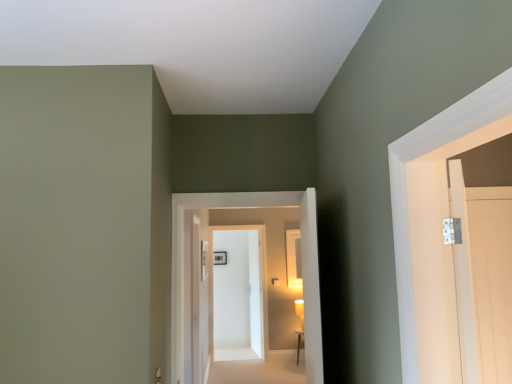
Question: Do you think white glossy door at center, the 3th door viewed from the right, is within white glossy door at center, the fourth door from the right, or outside of it?

Choices:
 (A) outside
 (B) inside

Answer: (A)

Question: From the image's perspective, is white glossy door at center, which appears as the first door when viewed from the back, located above or below white glossy door at center, which ranks as the 1th door in left-to-right order?

Choices:
 (A) below
 (B) above

Answer: (A)

Question: Which object is positioned farthest from the white glossy door at center, arranged as the second door when viewed from the right?

Choices:
 (A) white glossy door at center, which appears as the first door when viewed from the back
 (B) matte gold wall sconce at center
 (C) white glossy door at center, the fourth door from the right
 (D) smooth beige carpet at center
 (E) light wood door at right, arranged as the second door when viewed from the front

Answer: (A)

Question: Based on their relative distances, which object is nearer to the white glossy door at center, which appears as the 3th door when viewed from the left?

Choices:
 (A) smooth beige carpet at center
 (B) white glossy door at center, which appears as the first door when viewed from the back
 (C) light wood door at right, acting as the 3th door starting from the back
 (D) white glossy door at center, placed as the 3th door when sorted from front to back
 (E) matte gold wall sconce at center

Answer: (C)